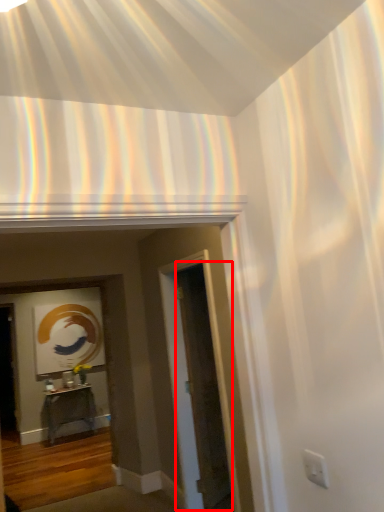
Question: From the image, what is the correct spatial relationship of glass door (annotated by the red box) in relation to table?

Choices:
 (A) left
 (B) right

Answer: (B)